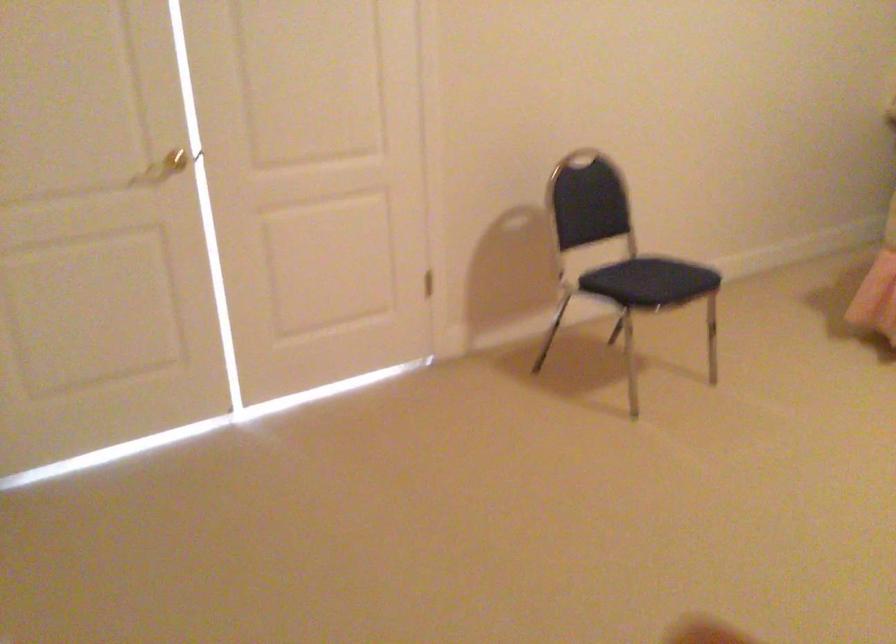
The height and width of the screenshot is (644, 896). What do you see at coordinates (168, 166) in the screenshot?
I see `a gold door handle` at bounding box center [168, 166].